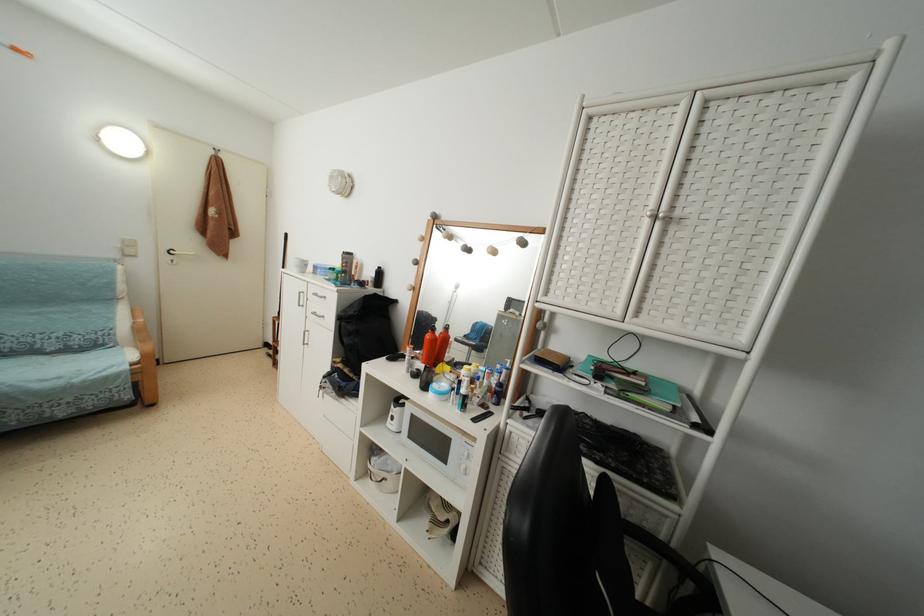
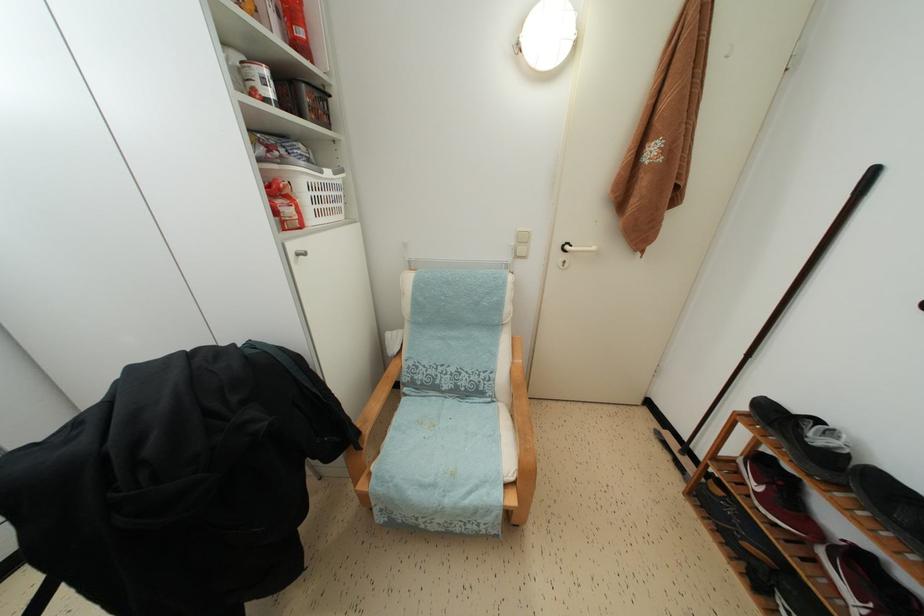
Find the pixel in the second image that matches pixel 275 358 in the first image.

(678, 450)